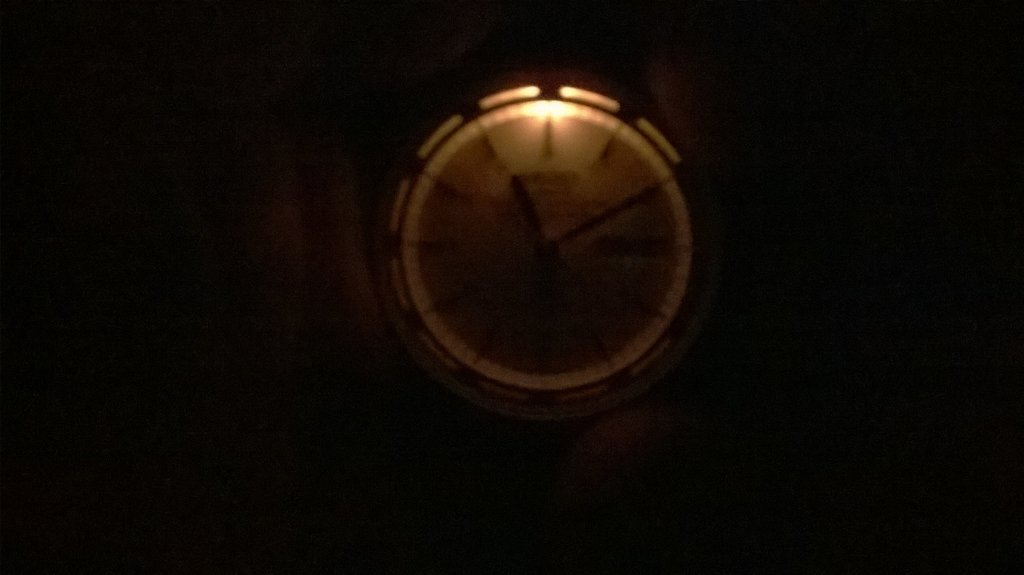
Where is `curtain texture background`? Image resolution: width=1024 pixels, height=575 pixels. curtain texture background is located at coordinates (328, 243), (696, 88).